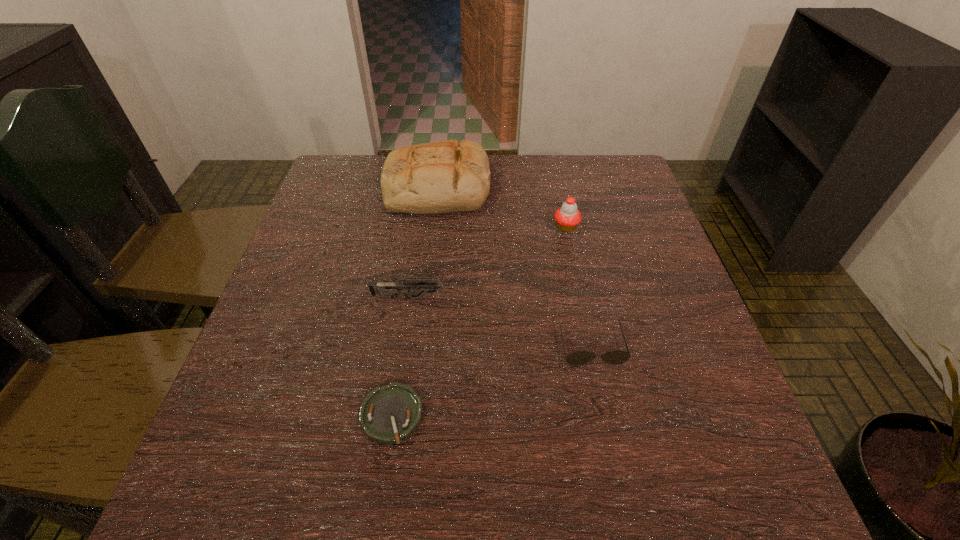
Find the location of a particular element. The image size is (960, 540). free spot between the second shortest object and the gun is located at coordinates (505, 322).

Where is `empty location between the bread and the cupcake`? The width and height of the screenshot is (960, 540). empty location between the bread and the cupcake is located at coordinates (501, 208).

Where is `free space between the fourth tallest object and the bread`? The height and width of the screenshot is (540, 960). free space between the fourth tallest object and the bread is located at coordinates (515, 267).

This screenshot has width=960, height=540. Find the location of `free point between the tallest object and the gun`. free point between the tallest object and the gun is located at coordinates (428, 244).

This screenshot has width=960, height=540. In order to click on free space that is in between the bread and the shortest object in this screenshot , I will do `click(415, 302)`.

The width and height of the screenshot is (960, 540). In order to click on free spot between the third nearest object and the ashtray in this screenshot , I will do `click(405, 357)`.

Identify the location of free space between the fourth tallest object and the tallest object. (515, 267).

This screenshot has width=960, height=540. Identify the location of free point between the fourth shortest object and the shortest object. (479, 322).

This screenshot has width=960, height=540. What are the coordinates of `free spot between the ashtray and the tallest object` in the screenshot? It's located at (415, 302).

This screenshot has height=540, width=960. Find the location of `object that is the second closest to the cupcake`. object that is the second closest to the cupcake is located at coordinates (616, 357).